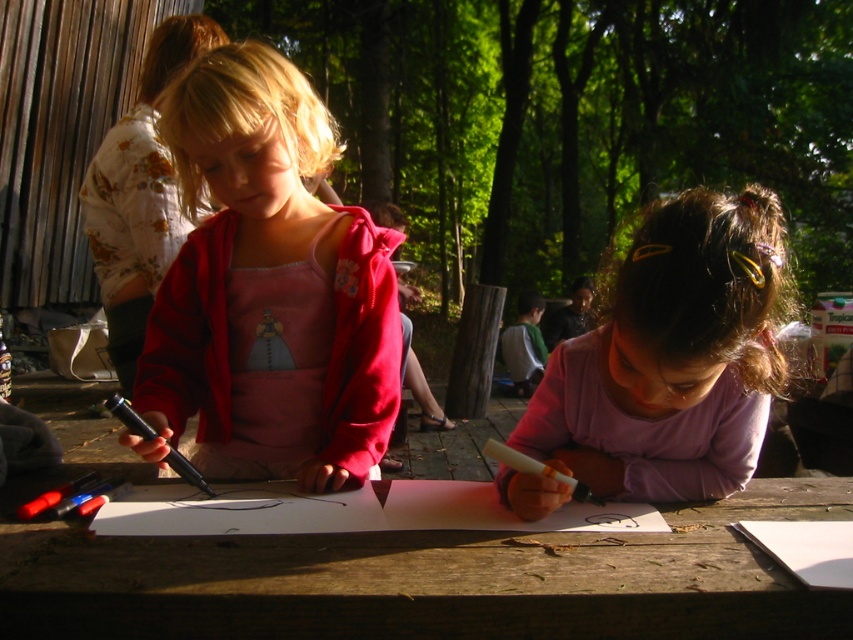
Question: Does wooden table at center have a greater width compared to matte pink hoodie at center?

Choices:
 (A) no
 (B) yes

Answer: (B)

Question: Can you confirm if wooden table at center is bigger than purple matte shirt at center?

Choices:
 (A) yes
 (B) no

Answer: (A)

Question: Which object is closer to the camera taking this photo?

Choices:
 (A) purple matte shirt at center
 (B) wooden table at center

Answer: (B)

Question: Which of the following is the closest to the observer?

Choices:
 (A) purple matte shirt at center
 (B) matte pink hoodie at center
 (C) wooden table at center

Answer: (C)

Question: Does matte pink hoodie at center have a greater width compared to purple matte shirt at center?

Choices:
 (A) yes
 (B) no

Answer: (A)

Question: Based on their relative distances, which object is farther from the purple matte shirt at center?

Choices:
 (A) matte pink hoodie at center
 (B) wooden table at center

Answer: (A)